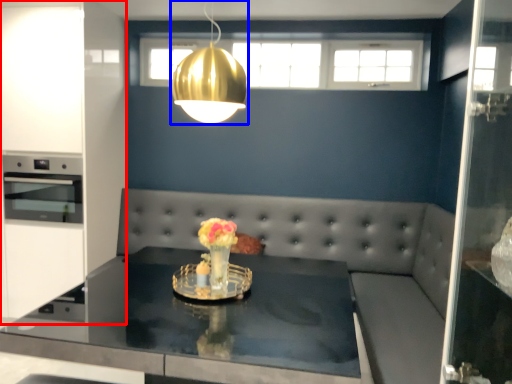
Question: Among these objects, which one is nearest to the camera, cabinetry (highlighted by a red box) or light (highlighted by a blue box)?

Choices:
 (A) cabinetry
 (B) light

Answer: (B)